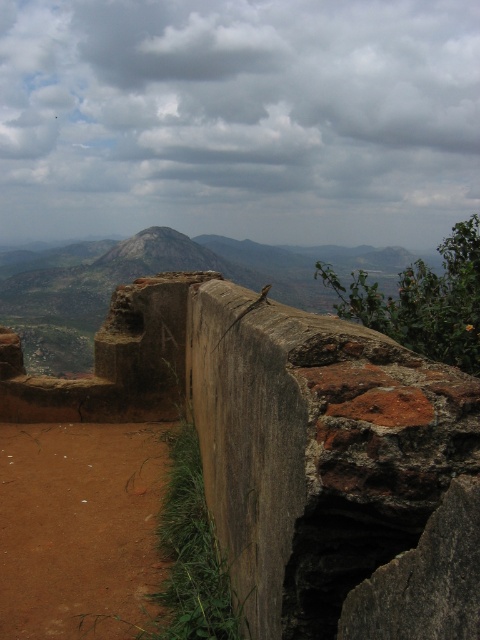
Is point (288, 632) positioned behind point (188, 246)?

No, (288, 632) is closer to viewer.

Does rusty brick wall at center lie behind rustic stone peak at center?

No, it is not.

Which is in front, point (280, 406) or point (189, 256)?

Point (280, 406) is in front.

Locate an element on the screen. The height and width of the screenshot is (640, 480). rusty brick wall at center is located at coordinates tap(335, 472).